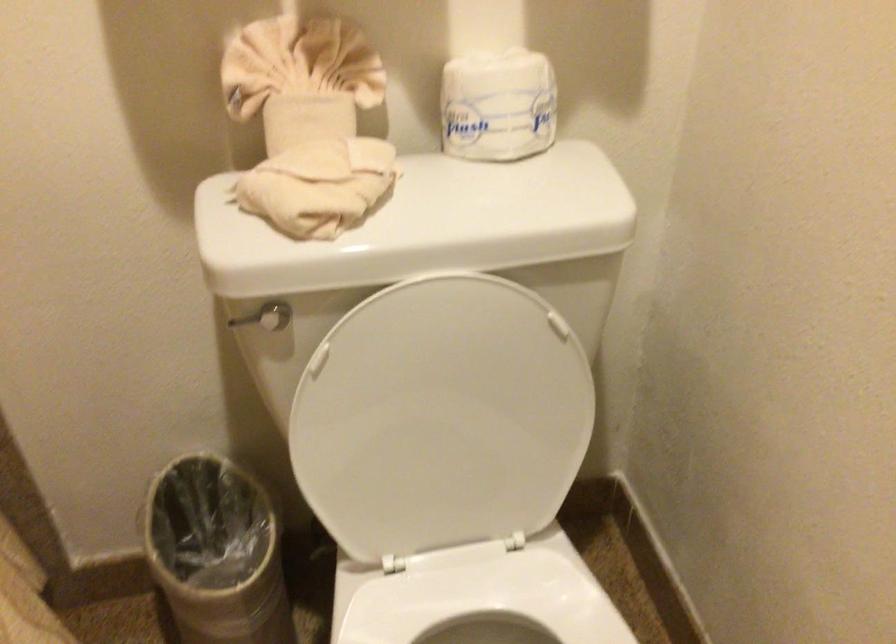
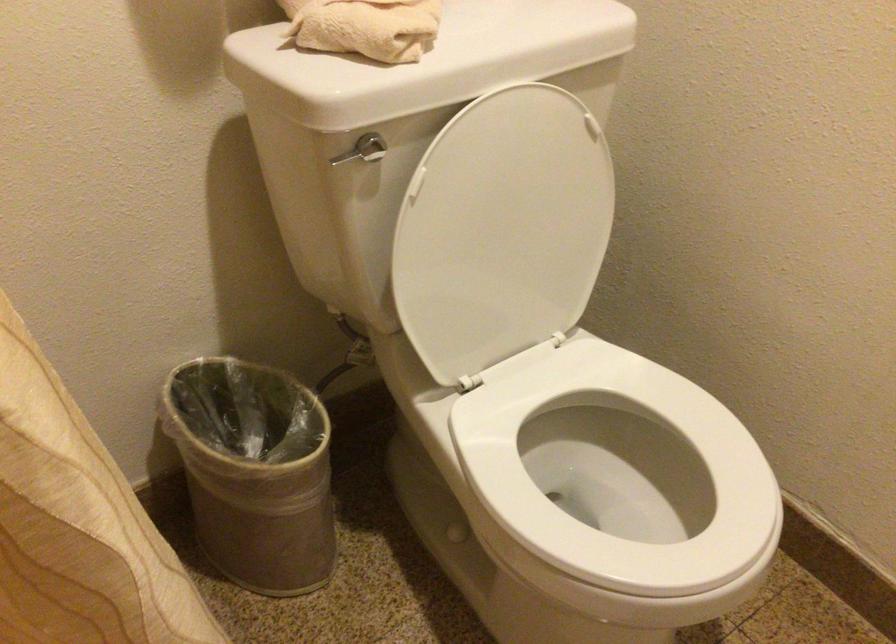
The point at [252,321] is marked in the first image. Where is the corresponding point in the second image?

(348, 155)